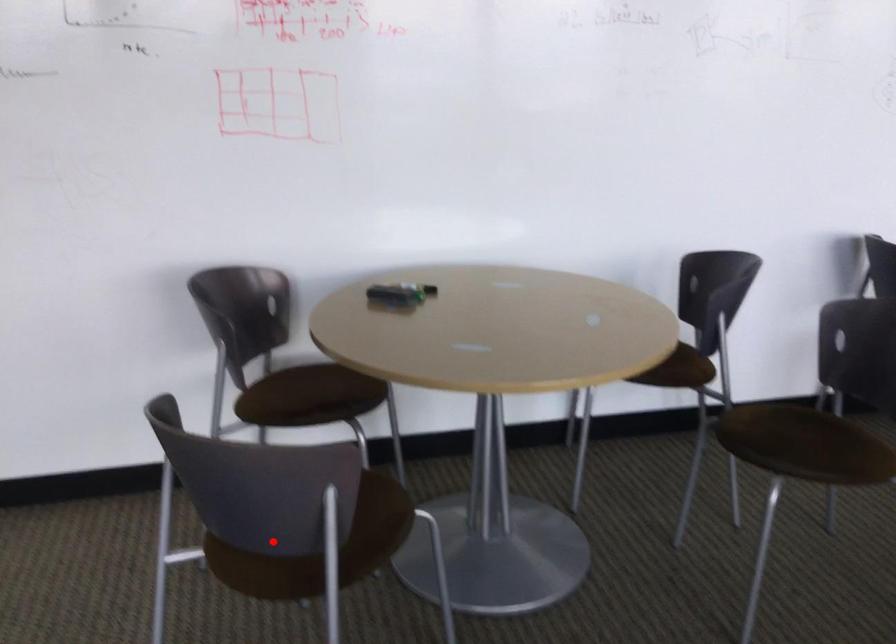
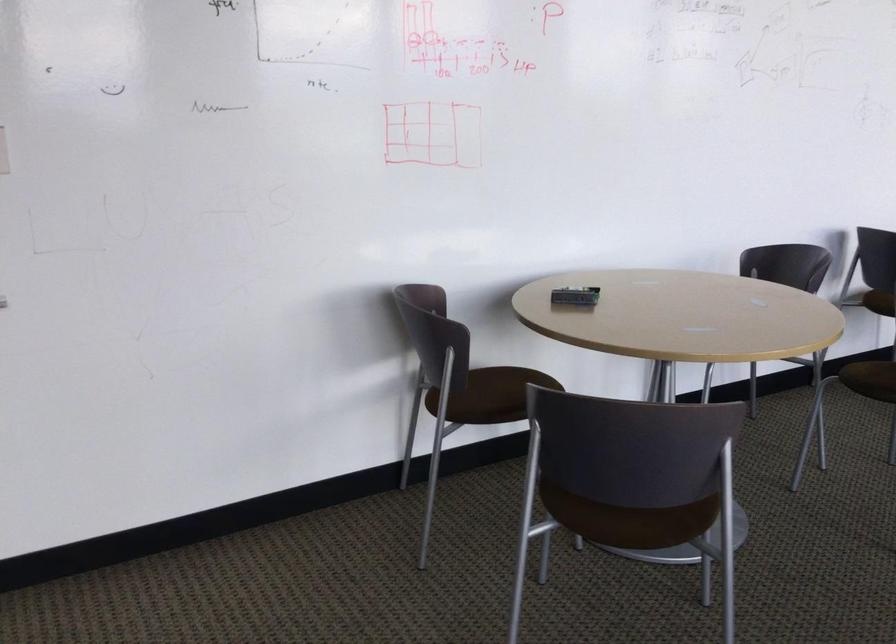
Find the pixel in the second image that matches the highlighted location in the first image.

(633, 505)